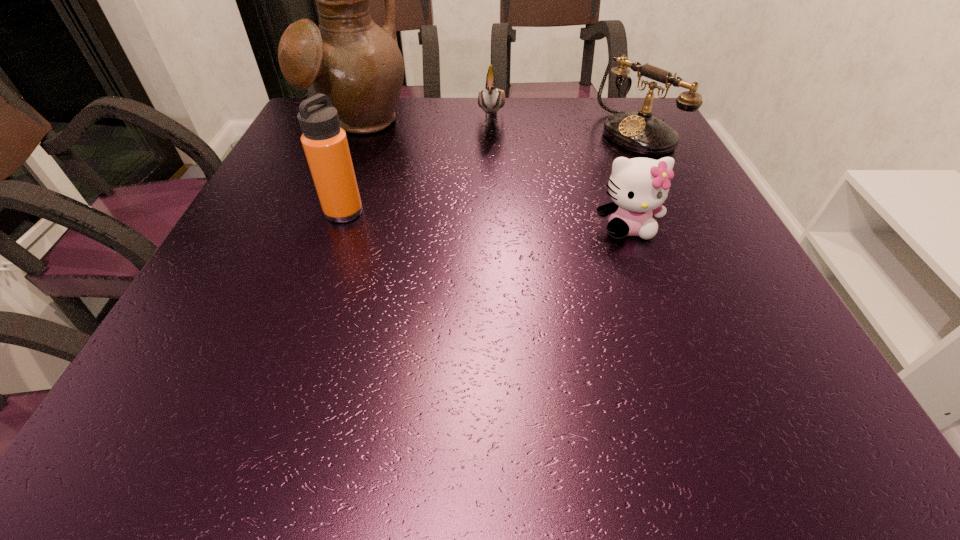
Find the location of `vacant region between the telephone and the fourth shortest object`. vacant region between the telephone and the fourth shortest object is located at coordinates (490, 173).

Identify the location of empty space that is in between the telephone and the second tallest object. (490, 173).

The image size is (960, 540). I want to click on free point between the telephone and the third object from left to right, so click(564, 126).

I want to click on free area in between the fourth shortest object and the kitten, so click(486, 220).

The height and width of the screenshot is (540, 960). What are the coordinates of `free space between the thermos bottle and the kitten` in the screenshot? It's located at (486, 220).

This screenshot has height=540, width=960. What are the coordinates of `vacant space that is in between the telephone and the second tallest object` in the screenshot? It's located at (490, 173).

Find the location of a particular element. Image resolution: width=960 pixels, height=540 pixels. object identified as the second closest to the bird is located at coordinates (640, 132).

Identify which object is the closest to the second tallest object. Please provide its 2D coordinates. Your answer should be formatted as a tuple, i.e. [(x, y)], where the tuple contains the x and y coordinates of a point satisfying the conditions above.

[(349, 58)]

Locate an element on the screen. vacant area in the image that satisfies the following two spatial constraints: 1. on the front side of the telephone; 2. on the right side of the third object from right to left is located at coordinates (492, 135).